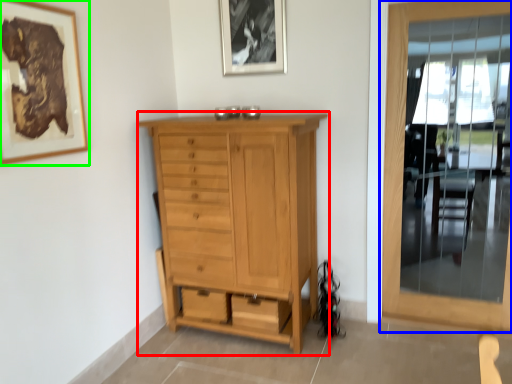
Question: Estimate the real-world distances between objects in this image. Which object is farther from chest of drawers (highlighted by a red box), door (highlighted by a blue box) or picture frame (highlighted by a green box)?

Choices:
 (A) door
 (B) picture frame

Answer: (A)